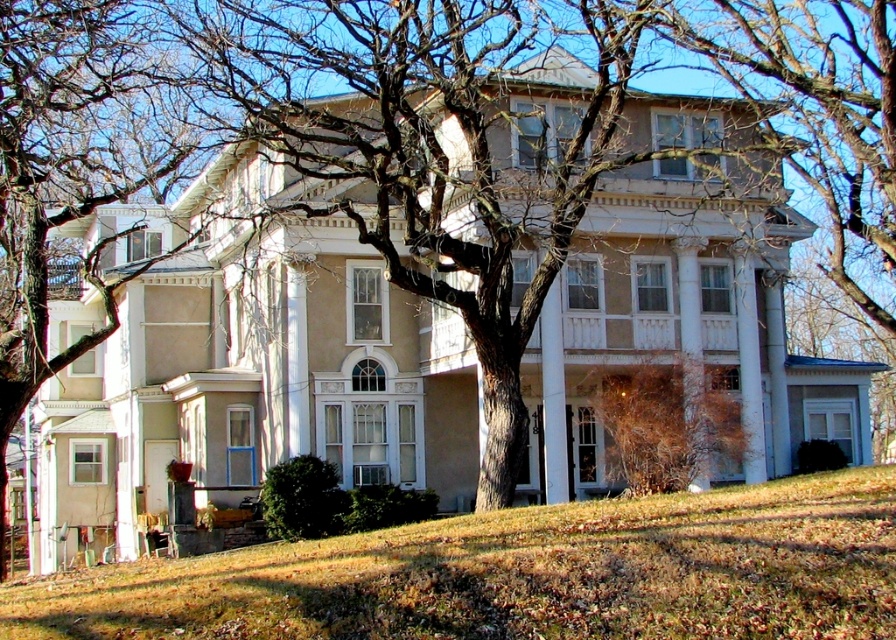
Question: Is brown bark tree at center bigger than brown bark tree at left?

Choices:
 (A) no
 (B) yes

Answer: (B)

Question: Which object appears farthest from the camera in this image?

Choices:
 (A) brown dry bush at lower right
 (B) brown grass at lower center
 (C) brown bark tree at center
 (D) brown bark tree at left

Answer: (D)

Question: Does brown bark tree at center appear on the right side of brown grass at lower center?

Choices:
 (A) yes
 (B) no

Answer: (B)

Question: Can you confirm if brown bark tree at center is positioned to the left of brown bark tree at left?

Choices:
 (A) no
 (B) yes

Answer: (A)

Question: Which point is farther from the camera taking this photo?

Choices:
 (A) (666, 422)
 (B) (490, 625)
 (C) (83, 120)

Answer: (C)

Question: Which is nearer to the brown bark tree at left?

Choices:
 (A) brown grass at lower center
 (B) brown dry bush at lower right

Answer: (B)